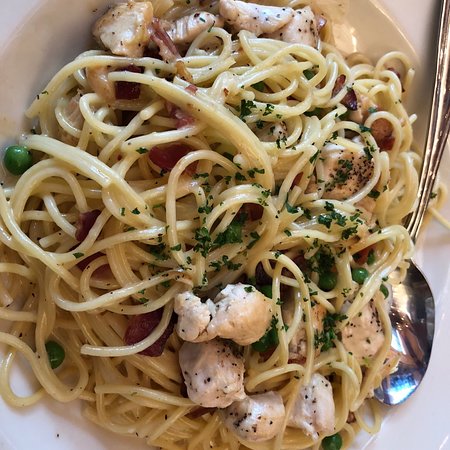
Identify the location of spoon. The height and width of the screenshot is (450, 450). (420, 300).